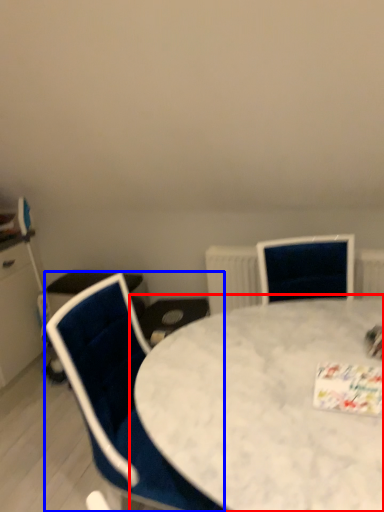
Question: Which point is further to the camera, table (highlighted by a red box) or chair (highlighted by a blue box)?

Choices:
 (A) table
 (B) chair

Answer: (B)